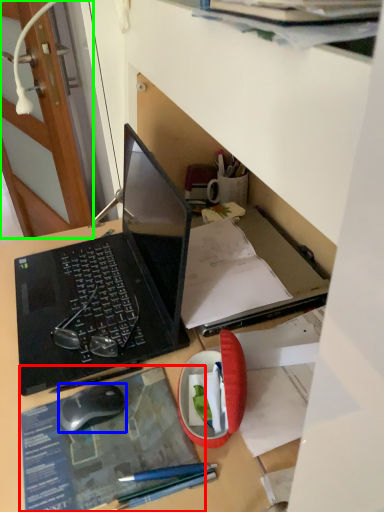
Question: Which is nearer to the paperback book (highlighted by a red box)? computer mouse (highlighted by a blue box) or door (highlighted by a green box).

Choices:
 (A) computer mouse
 (B) door

Answer: (A)